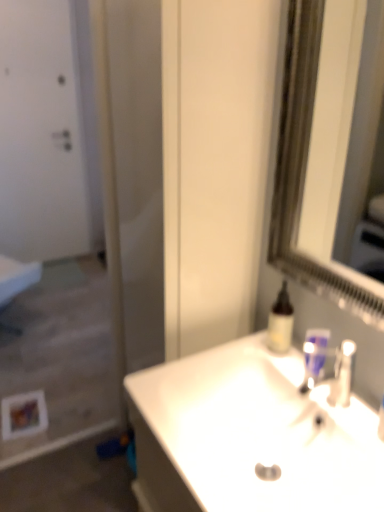
Question: Looking at their shapes, would you say blue plastic mouthwash at sink, the first mouthwash viewed from the right, is wider or thinner than translucent plastic bottle at upper right, acting as the 2th mouthwash starting from the right?

Choices:
 (A) wide
 (B) thin

Answer: (B)

Question: Based on their sizes in the image, would you say blue plastic mouthwash at sink, which is the second mouthwash from left to right, is bigger or smaller than translucent plastic bottle at upper right, which is the first mouthwash in left-to-right order?

Choices:
 (A) small
 (B) big

Answer: (A)

Question: Which object is positioned closest to the white matte screen door at left?

Choices:
 (A) translucent plastic bottle at upper right, which is the first mouthwash in left-to-right order
 (B) white glossy sink at center
 (C) silver metallic mirror at upper right
 (D) blue plastic mouthwash at sink, which is the second mouthwash from left to right
 (E) white matte door at upper left

Answer: (E)

Question: Which object is positioned farthest from the silver metallic mirror at upper right?

Choices:
 (A) blue plastic mouthwash at sink, the first mouthwash viewed from the right
 (B) white matte screen door at left
 (C) white glossy sink at center
 (D) white matte door at upper left
 (E) translucent plastic bottle at upper right, which is the first mouthwash in left-to-right order

Answer: (D)